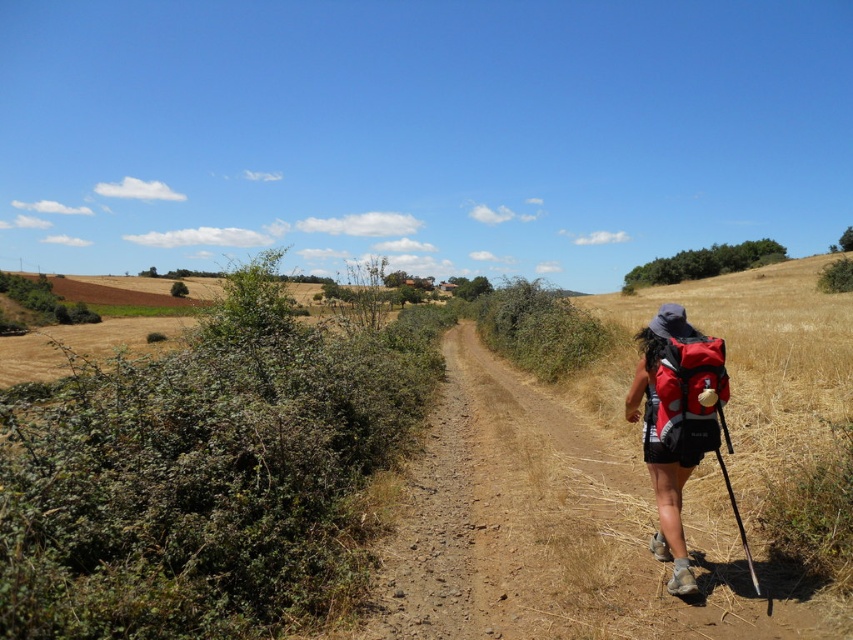
Does red fabric backpack at right have a greater height compared to red matte backpack at right?

Yes, red fabric backpack at right is taller than red matte backpack at right.

Is point (639, 337) positioned behind point (708, 362)?

Yes.

Between point (677, 548) and point (703, 412), which one is positioned in front?

Positioned in front is point (677, 548).

Where is `red fabric backpack at right`? red fabric backpack at right is located at coordinates (675, 422).